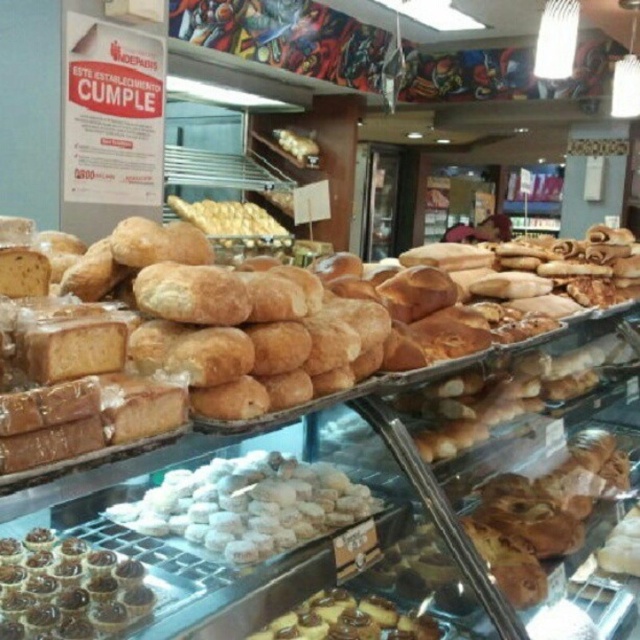
Question: Which object is the closest to the golden brown crusty loaf at center?

Choices:
 (A) chocolate glazed tartlets at lower left
 (B) white sugared cookies at center
 (C) chocolate glazed pastry at lower center

Answer: (B)

Question: Which of the following is the closest to the observer?

Choices:
 (A) golden brown crusty loaf at center
 (B) chocolate glazed pastry at lower center

Answer: (A)

Question: Does chocolate glazed tartlets at lower left have a greater width compared to chocolate glazed pastry at lower center?

Choices:
 (A) no
 (B) yes

Answer: (A)

Question: Can you confirm if golden brown crusty loaf at center is positioned above white sugared cookies at center?

Choices:
 (A) no
 (B) yes

Answer: (B)

Question: Is white sugared cookies at center smaller than chocolate glazed tartlets at lower left?

Choices:
 (A) no
 (B) yes

Answer: (A)

Question: Estimate the real-world distances between objects in this image. Which object is farther from the golden brown crusty loaf at center?

Choices:
 (A) chocolate glazed pastry at lower center
 (B) white sugared cookies at center

Answer: (A)